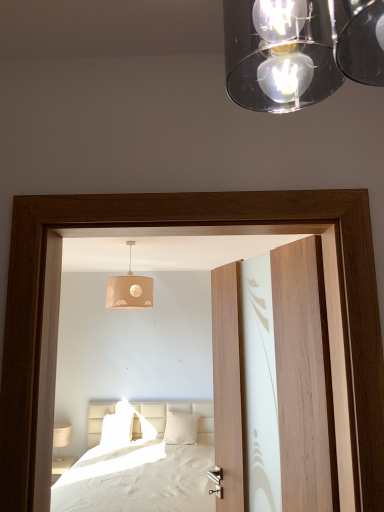
Question: From a real-world perspective, is white quilted bed at center above or below beige fabric lampshade at center?

Choices:
 (A) below
 (B) above

Answer: (A)

Question: Is white quilted bed at center to the left or to the right of beige fabric lampshade at center in the image?

Choices:
 (A) left
 (B) right

Answer: (A)

Question: Based on their relative distances, which object is nearer to the white quilted bed at center?

Choices:
 (A) beige fabric lampshade at center
 (B) white textured pillow at center, which is the 2th pillow from left to right
 (C) transparent glass door at center
 (D) white matte pillow at center, positioned as the 1th pillow in left-to-right order
 (E) white fabric table lamp at lower left

Answer: (C)

Question: Which of these objects is positioned closest to the beige fabric lampshade at center?

Choices:
 (A) white matte pillow at center, the 2th pillow from the right
 (B) white textured pillow at center, which is the 2th pillow from left to right
 (C) wooden door at center
 (D) white quilted bed at center
 (E) transparent glass door at center

Answer: (E)